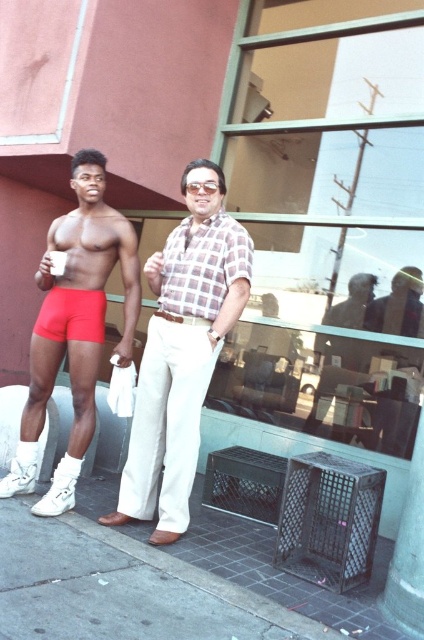
Does point (61, 280) come farther from viewer compared to point (50, 307)?

No, it is not.

Is matte red shorts at center positioned before matte red shorts at left?

Yes, matte red shorts at center is in front of matte red shorts at left.

Does point (77, 436) lie in front of point (44, 320)?

Yes.

The width and height of the screenshot is (424, 640). Identify the location of matte red shorts at center. (75, 326).

Who is lower down, matte red shorts at center or checkered fabric shirt at center?

Positioned lower is matte red shorts at center.

Does point (36, 376) lie in front of point (187, 230)?

No, it is not.

Who is more forward, (55, 289) or (240, 262)?

Point (240, 262) is in front.

This screenshot has height=640, width=424. In order to click on matte red shorts at center in this screenshot , I will do point(75,326).

From the picture: Which is below, matte plaid shirt at center or checkered fabric shirt at center?

matte plaid shirt at center is lower down.

The image size is (424, 640). Identify the location of matte plaid shirt at center. (181, 352).